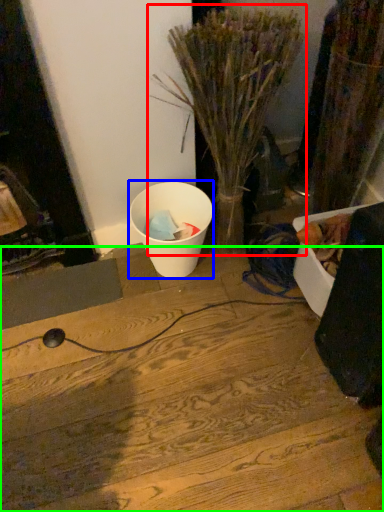
Question: Considering the real-world distances, which object is farthest from houseplant (highlighted by a red box)? waste (highlighted by a blue box) or wood (highlighted by a green box)?

Choices:
 (A) waste
 (B) wood

Answer: (B)